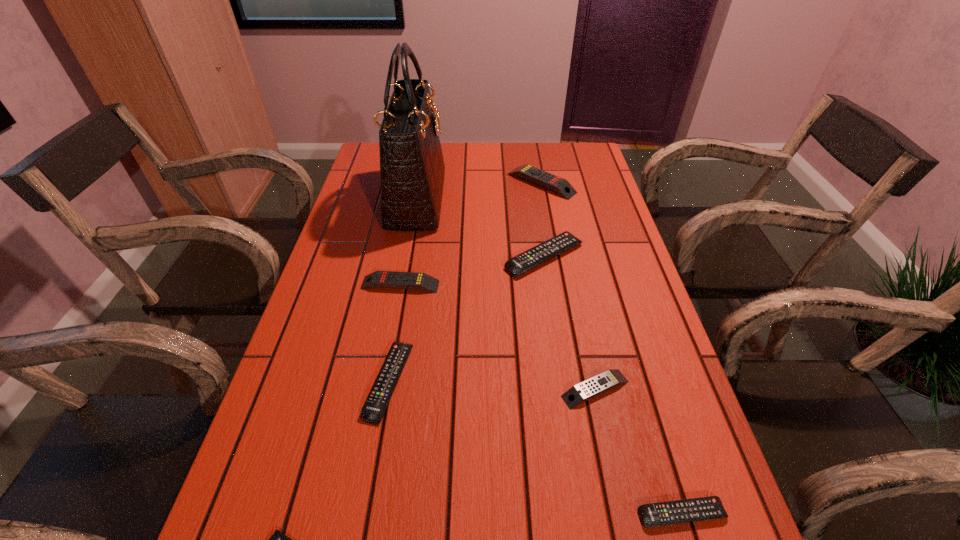
You are a GUI agent. You are given a task and a screenshot of the screen. Output one action in this format:
    pyautogui.click(x=<x>, y=<y>)
    Task: Click on the handbag at the left edge
    The image size is (960, 540).
    Given the screenshot: What is the action you would take?
    pyautogui.click(x=412, y=169)

Where is `remote control situated at the left edge`? The height and width of the screenshot is (540, 960). remote control situated at the left edge is located at coordinates (382, 279).

At what (x,y) coordinates should I click in order to perform the action: click on object that is at the far left corner. Please return your answer as a coordinate pair (x, y). Looking at the image, I should click on (412, 169).

Locate an element on the screen. The height and width of the screenshot is (540, 960). object that is at the far right corner is located at coordinates (557, 184).

Locate an element on the screen. free spot at the left edge of the desktop is located at coordinates (325, 308).

Where is `vacant space at the right edge of the desktop`? Image resolution: width=960 pixels, height=540 pixels. vacant space at the right edge of the desktop is located at coordinates (580, 201).

What are the coordinates of `free space that is in between the second farthest yellow remote control and the biggest black remote control` in the screenshot? It's located at (472, 271).

Where is `free space between the seventh shortest object and the leftmost black remote control`? free space between the seventh shortest object and the leftmost black remote control is located at coordinates (466, 282).

The height and width of the screenshot is (540, 960). In order to click on free space between the tallest remote control and the leftmost yellow remote control in this screenshot , I will do `click(470, 234)`.

Locate an element on the screen. This screenshot has height=540, width=960. free point between the biggest yellow remote control and the second farthest yellow remote control is located at coordinates (470, 234).